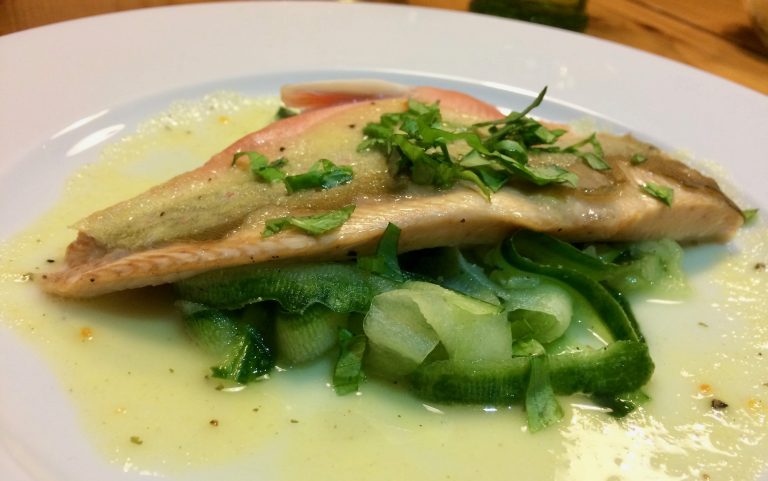
Where is `plate`? The height and width of the screenshot is (481, 768). plate is located at coordinates (53, 66).